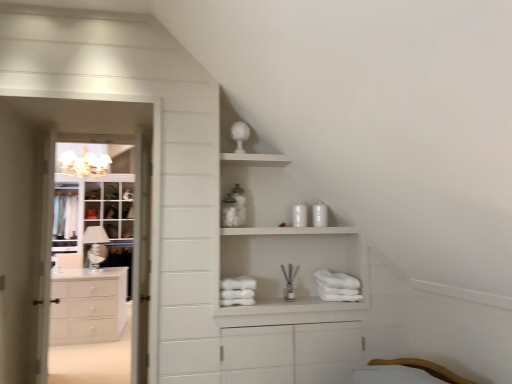
Question: In terms of height, does clear glass lamp at left look taller or shorter compared to white matte cabinet at upper center?

Choices:
 (A) short
 (B) tall

Answer: (A)

Question: Is clear glass lamp at left wider or thinner than white matte cabinet at upper center?

Choices:
 (A) wide
 (B) thin

Answer: (B)

Question: Which object is positioned closest to the white matte cabinet at upper center?

Choices:
 (A) white matte chest of drawers at left
 (B) white wood door at left
 (C) matte white chandelier at upper left
 (D) white glossy cabinet at left
 (E) clear glass lamp at left

Answer: (B)

Question: Which is farther from the white glossy cabinet at left?

Choices:
 (A) clear glass lamp at left
 (B) white matte chest of drawers at left
 (C) matte white chandelier at upper left
 (D) white matte cabinet at upper center
 (E) white wood door at left

Answer: (D)